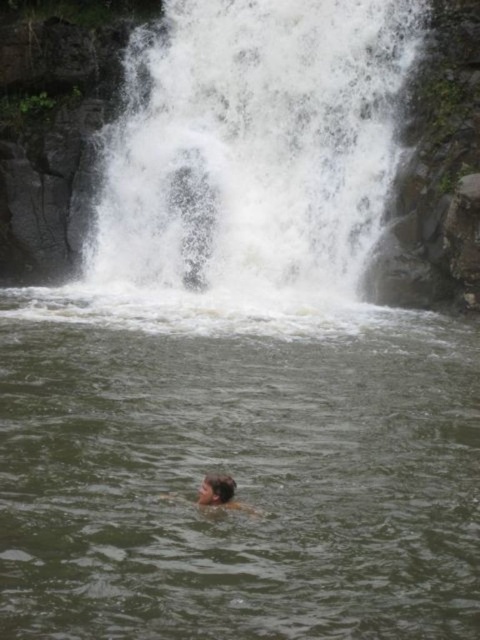
Which is behind, point (472, 577) or point (220, 490)?

Point (220, 490)

Does green liquid water at center have a lesser height compared to brown hair at lower center?

In fact, green liquid water at center may be taller than brown hair at lower center.

Who is more forward, (375, 554) or (232, 493)?

Positioned in front is point (375, 554).

Find the location of a particular element. The height and width of the screenshot is (640, 480). green liquid water at center is located at coordinates (236, 470).

Is white frothy water at upper center wider than brown hair at lower center?

Indeed, white frothy water at upper center has a greater width compared to brown hair at lower center.

Does white frothy water at upper center appear over brown hair at lower center?

Yes, white frothy water at upper center is above brown hair at lower center.

Locate an element on the screen. The height and width of the screenshot is (640, 480). white frothy water at upper center is located at coordinates (253, 147).

Between green liquid water at center and white frothy water at upper center, which one appears on the right side from the viewer's perspective?

Positioned to the right is white frothy water at upper center.

Looking at this image, does green liquid water at center appear over white frothy water at upper center?

Actually, green liquid water at center is below white frothy water at upper center.

Is point (13, 593) closer to camera compared to point (380, 145)?

Yes, it is in front of point (380, 145).

Where is `green liquid water at center`? green liquid water at center is located at coordinates (236, 470).